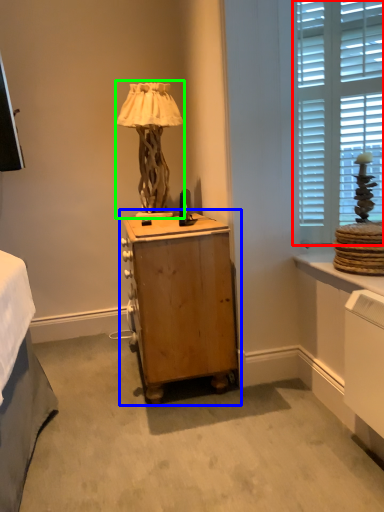
Question: Which object is positioned closest to window (highlighted by a red box)? Select from nightstand (highlighted by a blue box) and table lamp (highlighted by a green box).

Choices:
 (A) nightstand
 (B) table lamp

Answer: (A)